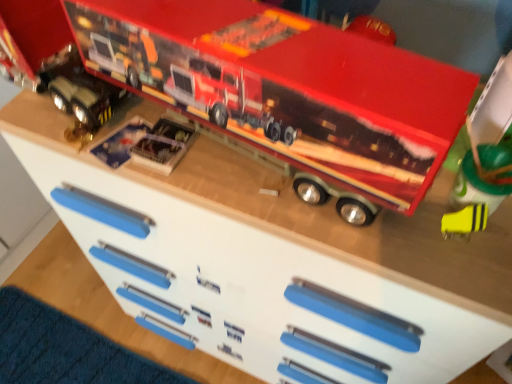
Find the location of `vacant space that's between metallic red truck at upper center, placed as the 3th toy when sorted from left to right, and metallic silver toy truck at center, positioned as the fourth toy in right-to-left order`. vacant space that's between metallic red truck at upper center, placed as the 3th toy when sorted from left to right, and metallic silver toy truck at center, positioned as the fourth toy in right-to-left order is located at coordinates (147, 177).